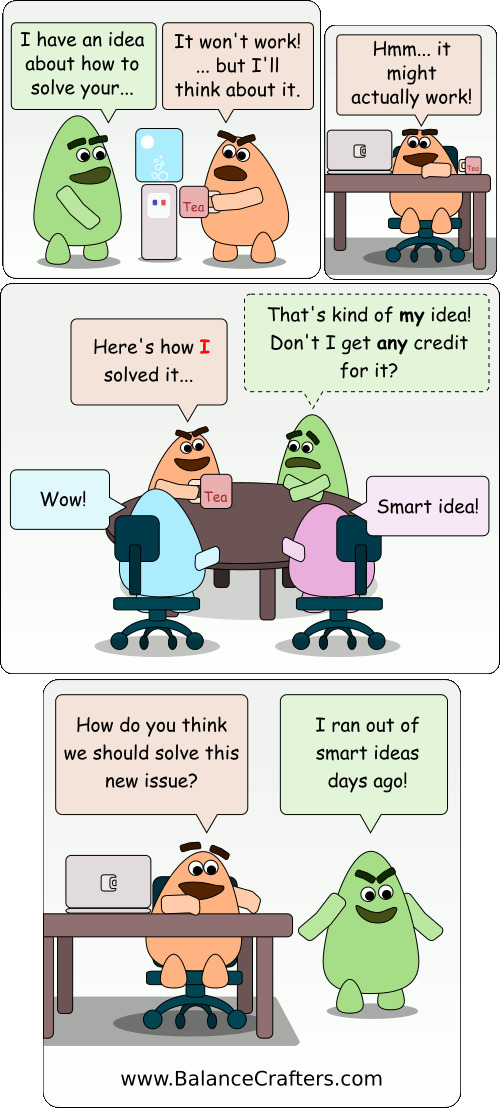
In order to click on desk in this screenshot , I will do `click(381, 178)`, `click(161, 923)`.